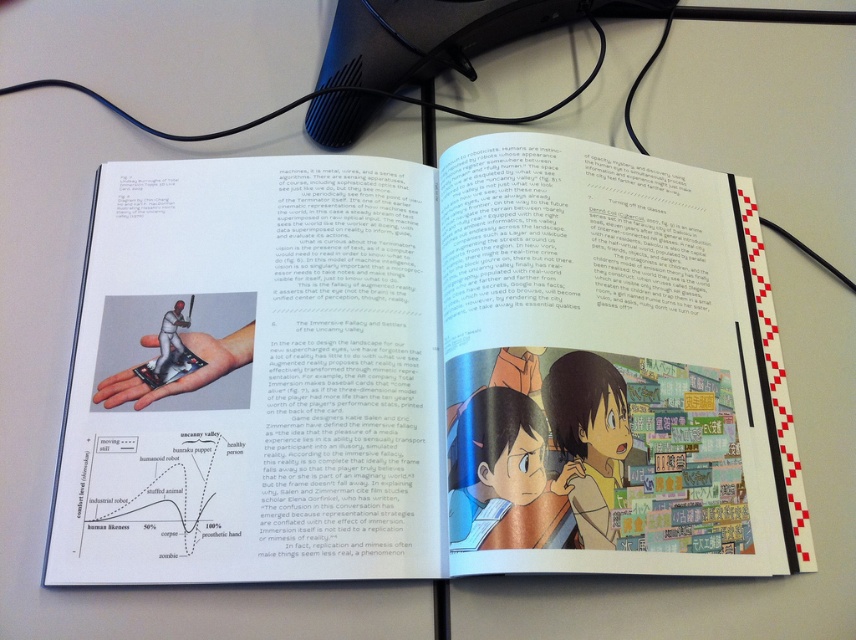
Can you confirm if matte paper book at center is positioned above smooth skin hand at center?

Yes, matte paper book at center is above smooth skin hand at center.

Is point (226, 256) closer to camera compared to point (230, 337)?

No, (226, 256) is further to viewer.

Locate an element on the screen. The height and width of the screenshot is (640, 856). matte paper book at center is located at coordinates (431, 372).